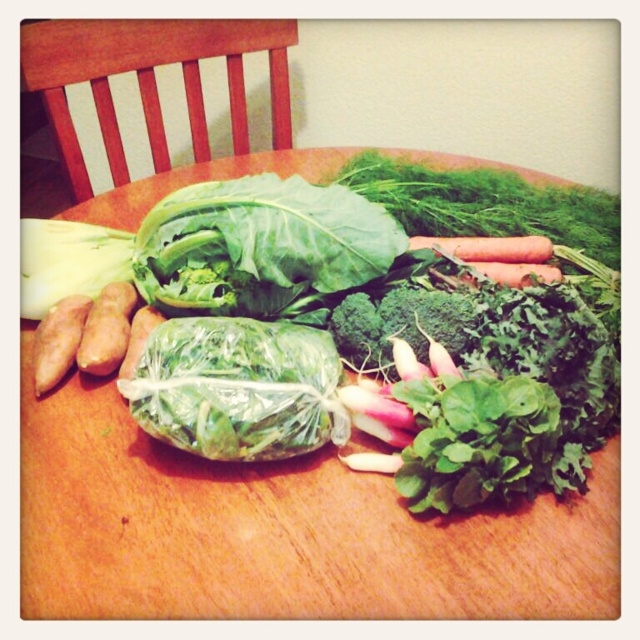
Question: Does green plastic-wrapped cabbage at center have a greater width compared to brown matte sweet potato at left?

Choices:
 (A) no
 (B) yes

Answer: (B)

Question: Which object is the closest to the smooth orange sweet potato at left?

Choices:
 (A) green plastic-wrapped cabbage at center
 (B) green leafy vegetables at center

Answer: (A)

Question: From the image, what is the correct spatial relationship of green leafy at center in relation to green leafy broccoli at center?

Choices:
 (A) right
 (B) left

Answer: (B)

Question: Which point appears farthest from the camera in this image?

Choices:
 (A) (44, 369)
 (B) (83, 515)
 (C) (77, 364)
 (D) (138, 237)

Answer: (D)

Question: Which point is closer to the camera?

Choices:
 (A) (65, 342)
 (B) (500, 529)
 (C) (179, 256)
 (D) (387, 352)

Answer: (B)

Question: Can you confirm if green leafy broccoli at center is positioned to the left of brown matte sweet potato at left?

Choices:
 (A) no
 (B) yes

Answer: (A)